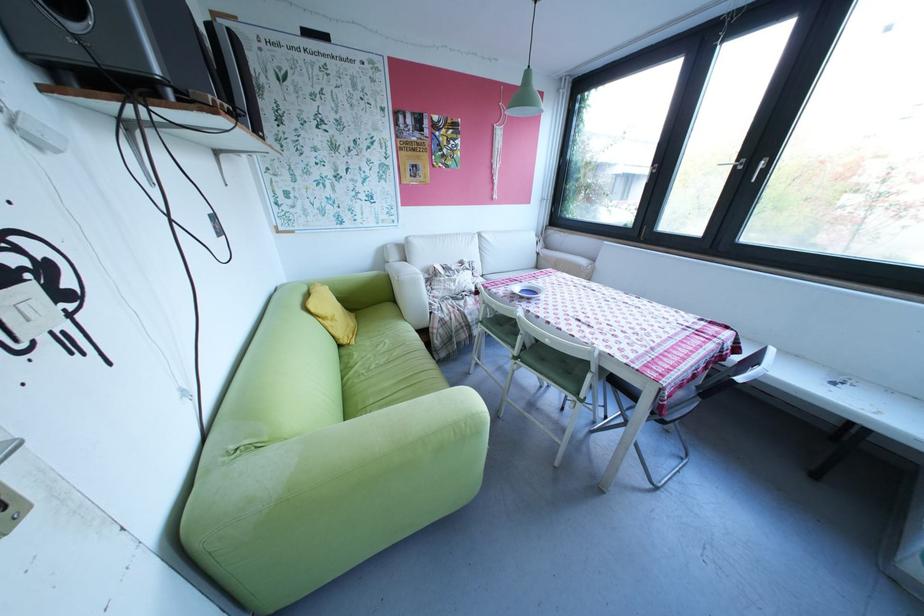
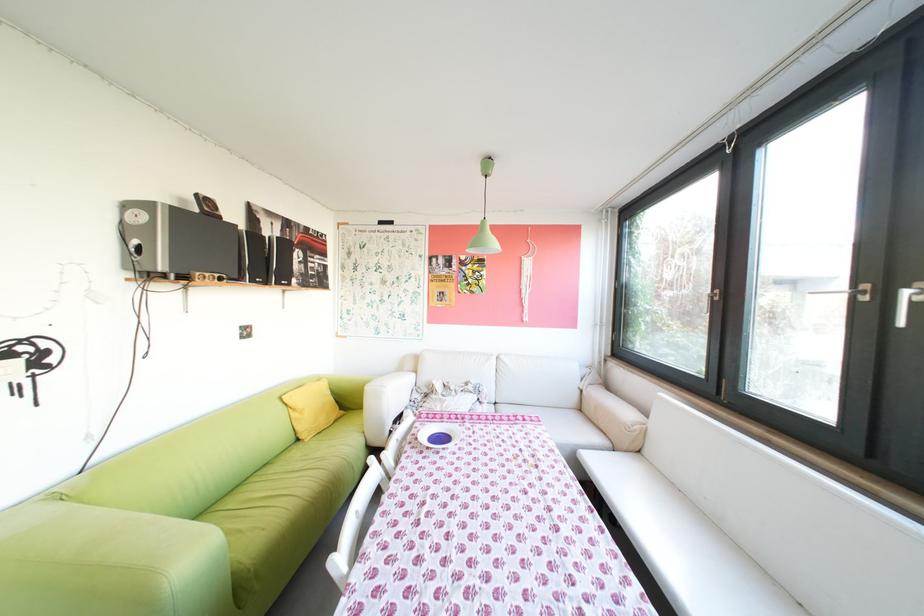
In the second image, find the point that corresponds to point 750,160 in the first image.

(867, 285)